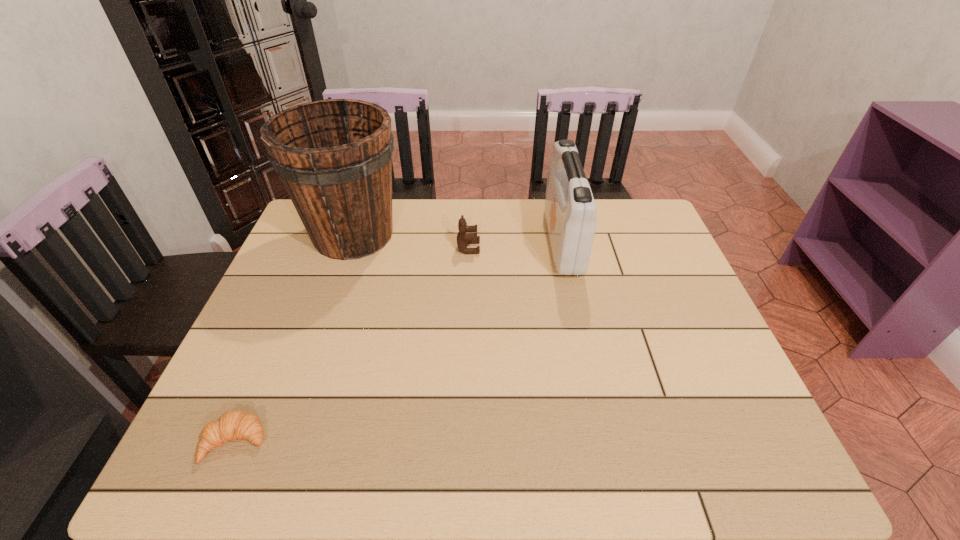
Locate an element on the screen. object that is at the near left corner is located at coordinates (232, 425).

In the image, there is a desktop. Where is `vacant space at the far edge`? vacant space at the far edge is located at coordinates (416, 224).

In the image, there is a desktop. Identify the location of vacant region at the near edge. (446, 443).

In the image, there is a desktop. Where is `free space at the left edge`? Image resolution: width=960 pixels, height=540 pixels. free space at the left edge is located at coordinates (276, 368).

In the image, there is a desktop. Identify the location of free space at the right edge. This screenshot has width=960, height=540. (619, 254).

The image size is (960, 540). I want to click on vacant space at the near left corner of the desktop, so click(x=233, y=447).

The width and height of the screenshot is (960, 540). I want to click on free region at the far right corner of the desktop, so click(610, 217).

Find the location of a particular element. This screenshot has width=960, height=540. free space between the second shortest object and the tallest object is located at coordinates (411, 241).

Locate an element on the screen. vacant space that's between the tallest object and the third tallest object is located at coordinates (411, 241).

Where is `free spot between the third tallest object and the rightmost object`? The height and width of the screenshot is (540, 960). free spot between the third tallest object and the rightmost object is located at coordinates (516, 245).